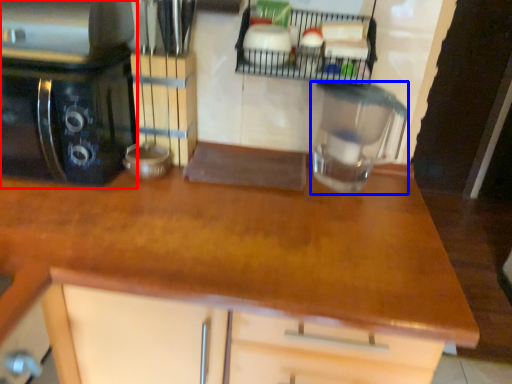
Question: Which of the following is the closest to the observer, home appliance (highlighted by a red box) or kitchen appliance (highlighted by a blue box)?

Choices:
 (A) home appliance
 (B) kitchen appliance

Answer: (A)